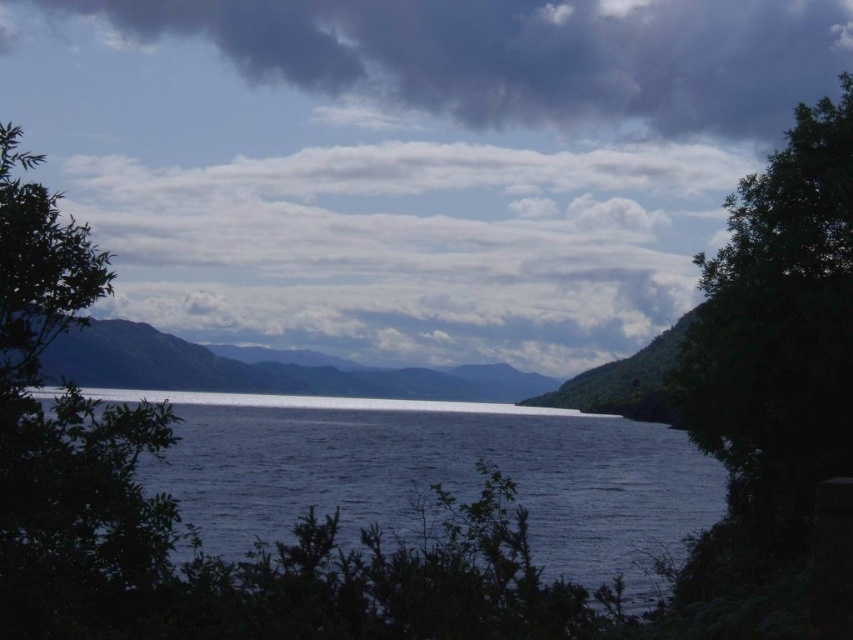
Who is more forward, (693,83) or (675,444)?

Point (675,444) is in front.

Based on the photo, is dark gray cloud at upper center to the right of dark blue water at center from the viewer's perspective?

In fact, dark gray cloud at upper center is to the left of dark blue water at center.

Is point (386, 52) positioned in front of point (587, 568)?

No.

Where is `dark gray cloud at upper center`? dark gray cloud at upper center is located at coordinates (515, 54).

Does green leafy tree at left have a lesser width compared to smooth gray mountain at center?

Yes, green leafy tree at left is thinner than smooth gray mountain at center.

Does green leafy tree at left appear over smooth gray mountain at center?

Indeed, green leafy tree at left is positioned over smooth gray mountain at center.

The image size is (853, 640). Describe the element at coordinates (67, 442) in the screenshot. I see `green leafy tree at left` at that location.

You are a GUI agent. You are given a task and a screenshot of the screen. Output one action in this format:
    pyautogui.click(x=<x>, y=<y>)
    Task: Click on the green leafy tree at left
    The width and height of the screenshot is (853, 640).
    Given the screenshot: What is the action you would take?
    pyautogui.click(x=67, y=442)

Is dark blue water at center shorter than green leafy tree at left?

In fact, dark blue water at center may be taller than green leafy tree at left.

This screenshot has height=640, width=853. I want to click on dark blue water at center, so click(x=434, y=470).

Locate an element on the screen. The height and width of the screenshot is (640, 853). dark blue water at center is located at coordinates (434, 470).